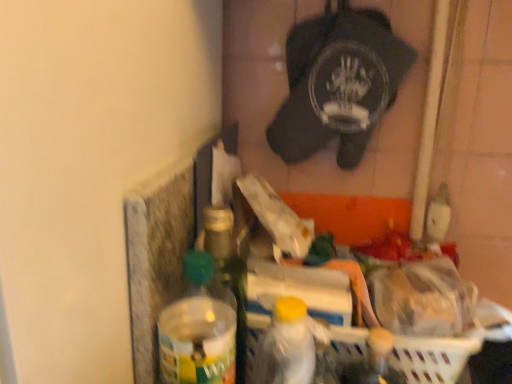
Describe the element at coordinates (434, 356) in the screenshot. I see `white plastic basket at lower right` at that location.

The image size is (512, 384). What do you see at coordinates (228, 273) in the screenshot?
I see `translucent plastic bottle at center, which is the second bottle in left-to-right order` at bounding box center [228, 273].

Locate an element on the screen. white plastic basket at lower right is located at coordinates (434, 356).

From the image's perspective, is white plastic basket at lower right on top of white plastic bottle at center, the first bottle positioned from the right?

Actually, white plastic basket at lower right appears below white plastic bottle at center, the first bottle positioned from the right, in the image.

Between white plastic basket at lower right and white plastic bottle at center, the 3th bottle positioned from the left, which one has smaller size?

white plastic basket at lower right.

How different are the orientations of white plastic basket at lower right and white plastic bottle at center, the first bottle positioned from the right, in degrees?

There is a 0.655-degree angle between the facing directions of white plastic basket at lower right and white plastic bottle at center, the first bottle positioned from the right.

Is white plastic basket at lower right taller or shorter than white plastic bottle at center, the 3th bottle positioned from the left?

white plastic basket at lower right is shorter than white plastic bottle at center, the 3th bottle positioned from the left.

Is translucent plastic bottle at center, positioned as the 1th bottle in left-to-right order, at the back of white plastic bottle at center, the first bottle positioned from the right?

No, white plastic bottle at center, the first bottle positioned from the right,'s orientation is not away from translucent plastic bottle at center, positioned as the 1th bottle in left-to-right order.

Is white plastic bottle at center, the 3th bottle positioned from the left, positioned behind translucent plastic bottle at center, positioned as the 1th bottle in left-to-right order?

Yes, white plastic bottle at center, the 3th bottle positioned from the left, is behind translucent plastic bottle at center, positioned as the 1th bottle in left-to-right order.

In the image, there is a translucent plastic bottle at center, positioned as the 1th bottle in left-to-right order. Identify the location of bottle below it (from a real-world perspective). This screenshot has height=384, width=512. (286, 346).

From the picture: From the image's perspective, is white plastic bottle at center, the first bottle positioned from the right, located above or below translucent plastic bottle at center, which is the third bottle in right-to-left order?

white plastic bottle at center, the first bottle positioned from the right, is below translucent plastic bottle at center, which is the third bottle in right-to-left order.

From the picture: Is translucent plastic bottle at center, which is the second bottle in left-to-right order, facing away from white plastic bottle at center, the first bottle positioned from the right?

No, translucent plastic bottle at center, which is the second bottle in left-to-right order, is not facing the opposite direction of white plastic bottle at center, the first bottle positioned from the right.

The width and height of the screenshot is (512, 384). Identify the location of the 2nd bottle positioned below the translucent plastic bottle at center, the 2th bottle viewed from the right (from the image's perspective). (286, 346).

Considering the relative sizes of translucent plastic bottle at center, the 2th bottle viewed from the right, and white plastic bottle at center, the first bottle positioned from the right, in the image provided, is translucent plastic bottle at center, the 2th bottle viewed from the right, wider than white plastic bottle at center, the first bottle positioned from the right,?

No.

What are the coordinates of `bottle in front of the white plastic bottle at center, the first bottle positioned from the right` in the screenshot? It's located at (198, 328).

Between translucent plastic bottle at center, which is the third bottle in right-to-left order, and white plastic bottle at center, the first bottle positioned from the right, which one is positioned in front?

translucent plastic bottle at center, which is the third bottle in right-to-left order, is more forward.

Which is in front, point (213, 307) or point (271, 322)?

The point (271, 322) is closer.

Is translucent plastic bottle at center, the 2th bottle viewed from the right, positioned before white plastic basket at lower right?

No, translucent plastic bottle at center, the 2th bottle viewed from the right, is further to the viewer.

Identify the location of bottle that is the 2nd object to the left of the white plastic basket at lower right, starting at the anchor. (228, 273).

Considering the relative sizes of translucent plastic bottle at center, the 2th bottle viewed from the right, and white plastic basket at lower right in the image provided, is translucent plastic bottle at center, the 2th bottle viewed from the right, wider than white plastic basket at lower right?

No.

Choose the correct answer: Is translucent plastic bottle at center, which is the second bottle in left-to-right order, inside white plastic basket at lower right or outside it?

translucent plastic bottle at center, which is the second bottle in left-to-right order, cannot be found inside white plastic basket at lower right.

Which object is closer to the camera taking this photo, white plastic basket at lower right or translucent plastic bottle at center, which is the third bottle in right-to-left order?

translucent plastic bottle at center, which is the third bottle in right-to-left order, is more forward.

From the image's perspective, is white plastic basket at lower right above or below translucent plastic bottle at center, positioned as the 1th bottle in left-to-right order?

white plastic basket at lower right is below translucent plastic bottle at center, positioned as the 1th bottle in left-to-right order.

Does white plastic basket at lower right have a smaller size compared to translucent plastic bottle at center, which is the third bottle in right-to-left order?

Indeed, white plastic basket at lower right has a smaller size compared to translucent plastic bottle at center, which is the third bottle in right-to-left order.

Is translucent plastic bottle at center, positioned as the 1th bottle in left-to-right order, at the back of white plastic basket at lower right?

No.

Can you confirm if translucent plastic bottle at center, the 2th bottle viewed from the right, is wider than translucent plastic bottle at center, positioned as the 1th bottle in left-to-right order?

Incorrect, the width of translucent plastic bottle at center, the 2th bottle viewed from the right, does not surpass that of translucent plastic bottle at center, positioned as the 1th bottle in left-to-right order.

Is translucent plastic bottle at center, the 2th bottle viewed from the right, turned away from translucent plastic bottle at center, positioned as the 1th bottle in left-to-right order?

No.

Where is `the 1st bottle positioned below the translucent plastic bottle at center, the 2th bottle viewed from the right (from the image's perspective)`? This screenshot has height=384, width=512. the 1st bottle positioned below the translucent plastic bottle at center, the 2th bottle viewed from the right (from the image's perspective) is located at coordinates (198, 328).

The image size is (512, 384). What are the coordinates of `basket below the white plastic bottle at center, the 3th bottle positioned from the left (from a real-world perspective)` in the screenshot? It's located at (434, 356).

Which bottle is the 1st one when counting from the back of the translucent plastic bottle at center, positioned as the 1th bottle in left-to-right order? Please provide its 2D coordinates.

[(286, 346)]

Estimate the real-world distances between objects in this image. Which object is closer to white plastic basket at lower right, translucent plastic bottle at center, the 2th bottle viewed from the right, or translucent plastic bottle at center, which is the third bottle in right-to-left order?

translucent plastic bottle at center, the 2th bottle viewed from the right, is positioned closer to the anchor white plastic basket at lower right.

Considering their positions, is white plastic bottle at center, the first bottle positioned from the right, positioned further to translucent plastic bottle at center, which is the third bottle in right-to-left order, than translucent plastic bottle at center, the 2th bottle viewed from the right?

Among the two, translucent plastic bottle at center, the 2th bottle viewed from the right, is located further to translucent plastic bottle at center, which is the third bottle in right-to-left order.

When comparing their distances from white plastic basket at lower right, does white plastic bottle at center, the first bottle positioned from the right, or translucent plastic bottle at center, which is the third bottle in right-to-left order, seem further?

translucent plastic bottle at center, which is the third bottle in right-to-left order, is further to white plastic basket at lower right.

Which object lies further to the anchor point translucent plastic bottle at center, positioned as the 1th bottle in left-to-right order, white plastic basket at lower right or translucent plastic bottle at center, the 2th bottle viewed from the right?

Based on the image, white plastic basket at lower right appears to be further to translucent plastic bottle at center, positioned as the 1th bottle in left-to-right order.

Considering their positions, is white plastic bottle at center, the first bottle positioned from the right, positioned further to translucent plastic bottle at center, the 2th bottle viewed from the right, than translucent plastic bottle at center, positioned as the 1th bottle in left-to-right order?

Among the two, white plastic bottle at center, the first bottle positioned from the right, is located further to translucent plastic bottle at center, the 2th bottle viewed from the right.

Based on their spatial positions, is translucent plastic bottle at center, which is the second bottle in left-to-right order, or white plastic bottle at center, the first bottle positioned from the right, further from translucent plastic bottle at center, positioned as the 1th bottle in left-to-right order?

translucent plastic bottle at center, which is the second bottle in left-to-right order, is further to translucent plastic bottle at center, positioned as the 1th bottle in left-to-right order.

Based on their spatial positions, is white plastic bottle at center, the 3th bottle positioned from the left, or white plastic basket at lower right further from translucent plastic bottle at center, the 2th bottle viewed from the right?

white plastic basket at lower right is further to translucent plastic bottle at center, the 2th bottle viewed from the right.

Looking at the image, which one is located closer to white plastic bottle at center, the 3th bottle positioned from the left, translucent plastic bottle at center, positioned as the 1th bottle in left-to-right order, or translucent plastic bottle at center, the 2th bottle viewed from the right?

translucent plastic bottle at center, positioned as the 1th bottle in left-to-right order, lies closer to white plastic bottle at center, the 3th bottle positioned from the left, than the other object.

Identify the location of bottle between translucent plastic bottle at center, the 2th bottle viewed from the right, and white plastic basket at lower right, in the horizontal direction. (286, 346).

At what (x,y) coordinates should I click in order to perform the action: click on bottle situated between translucent plastic bottle at center, which is the third bottle in right-to-left order, and white plastic bottle at center, the first bottle positioned from the right, from left to right. Please return your answer as a coordinate pair (x, y). Looking at the image, I should click on (228, 273).